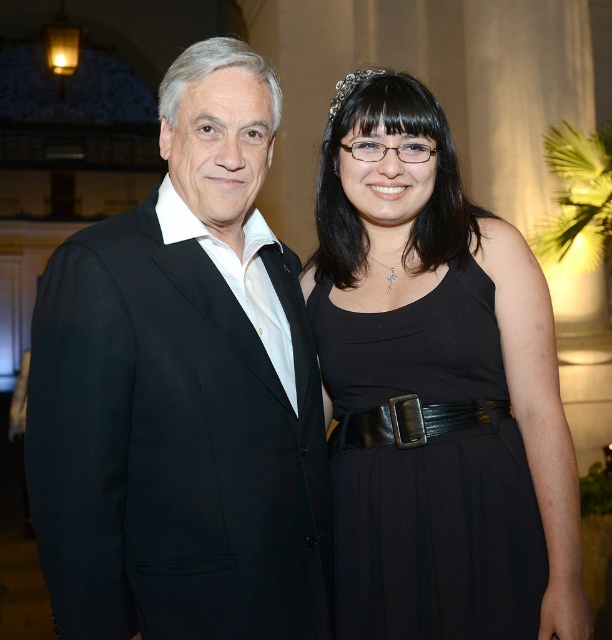
Question: From the image, what is the correct spatial relationship of black matte suit at left in relation to black leather dress at center?

Choices:
 (A) above
 (B) below

Answer: (A)

Question: Which object is closer to the camera taking this photo?

Choices:
 (A) black leather belt at center
 (B) silver metallic tiara at upper center
 (C) black leather dress at center

Answer: (C)

Question: Is black matte suit at left bigger than black leather belt at center?

Choices:
 (A) yes
 (B) no

Answer: (A)

Question: Which of the following is the closest to the observer?

Choices:
 (A) black leather belt at center
 (B) silver metallic tiara at upper center

Answer: (A)

Question: Can you confirm if black leather dress at center is positioned above silver metallic tiara at upper center?

Choices:
 (A) yes
 (B) no

Answer: (B)

Question: Among these objects, which one is nearest to the camera?

Choices:
 (A) silver metallic tiara at upper center
 (B) black leather belt at center
 (C) black matte suit at left
 (D) black leather dress at center

Answer: (C)